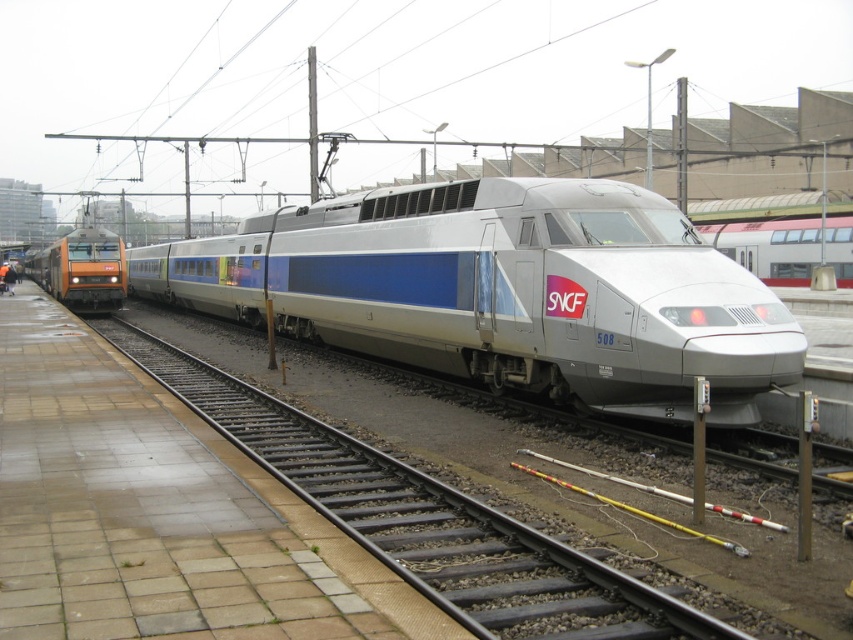
Question: Among these points, which one is nearest to the camera?

Choices:
 (A) (230, 268)
 (B) (107, 266)
 (C) (738, 248)

Answer: (A)

Question: Does silver metallic bullet train at center appear over silver metallic train at center?

Choices:
 (A) yes
 (B) no

Answer: (B)

Question: Which object appears farthest from the camera in this image?

Choices:
 (A) silver metallic train at center
 (B) silver metallic bullet train at center
 (C) orange metallic locomotive at left

Answer: (C)

Question: Which point is closer to the camera taking this photo?

Choices:
 (A) (595, 232)
 (B) (750, 269)
 (C) (42, 256)

Answer: (A)

Question: Is silver metallic bullet train at center positioned at the back of silver metallic train at center?

Choices:
 (A) no
 (B) yes

Answer: (A)

Question: Is silver metallic bullet train at center further to the viewer compared to silver metallic train at center?

Choices:
 (A) no
 (B) yes

Answer: (A)